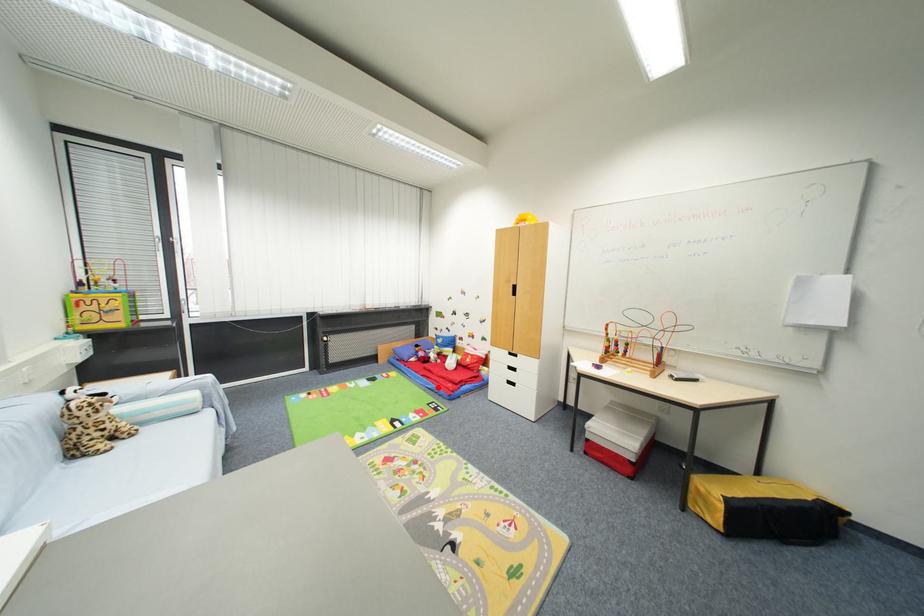
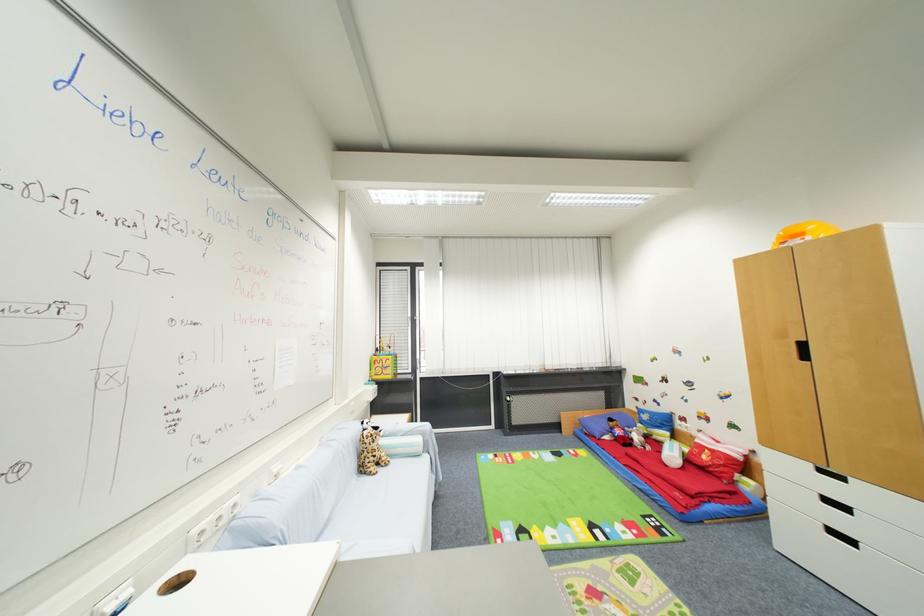
The point at the highlighted location is marked in the first image. Where is the corresponding point in the second image?

(650, 488)